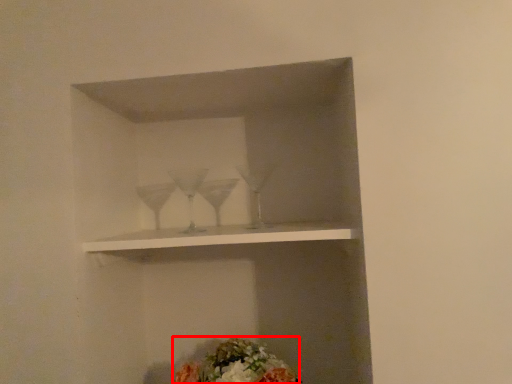
Question: From the image's perspective, what is the correct spatial relationship of flower (annotated by the red box) in relation to shelf?

Choices:
 (A) above
 (B) below

Answer: (B)